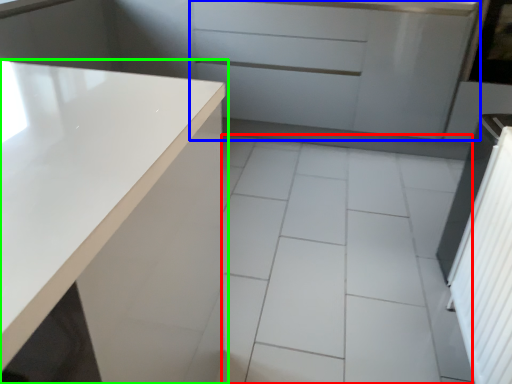
Question: Which object is the farthest from ceramic tile (highlighted by a red box)? Choose among these: cabinetry (highlighted by a blue box) or countertop (highlighted by a green box).

Choices:
 (A) cabinetry
 (B) countertop

Answer: (A)